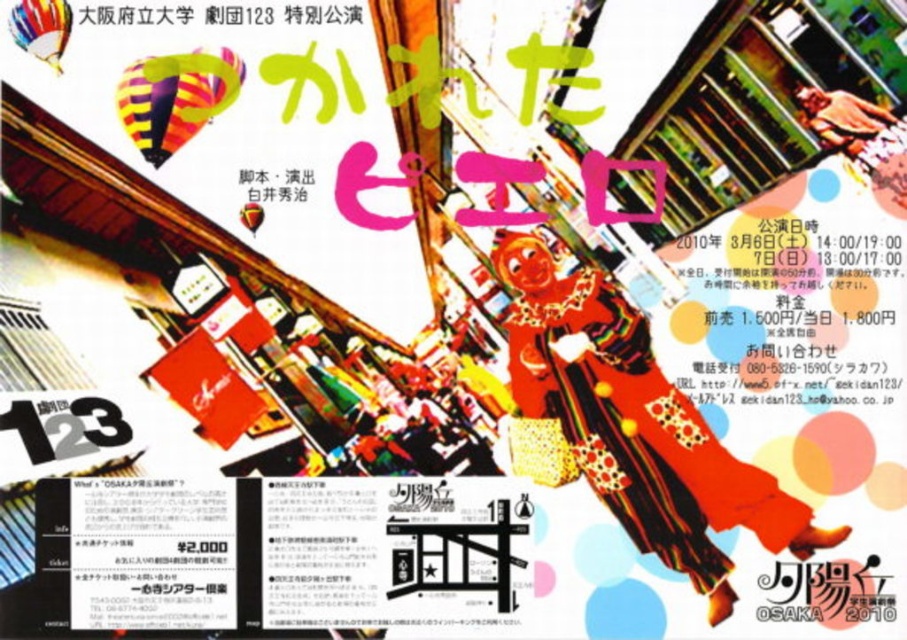
You are an art student analyzing the poster for a class project. You notice the matte red poster at center and the rainbow striped balloon at upper left. Which object is closer to you, the viewer?

The matte red poster at center is closer to you because it is positioned further to the viewer than the rainbow striped balloon at upper left.

You are designing a layout for a theater poster and want to ensure that the matte red poster at center and the rainbow striped balloon at upper left are placed appropriately. Given their sizes, which object should you place further back in the design to maintain visual balance?

The matte red poster at center should be placed further back in the design because its width is larger than the rainbow striped balloon at upper left, which helps maintain visual balance by compensating for its larger size with a more distant placement.

You are an event planner reviewing the promotional materials for the play. You need to determine if the multicolored striped balloon at upper left can be placed above the matte red poster at center without overlapping. Based on their sizes, is this possible?

The matte red poster at center is much taller than the multicolored striped balloon at upper left. Since the balloon is smaller in height, it can be placed above the poster without overlapping.